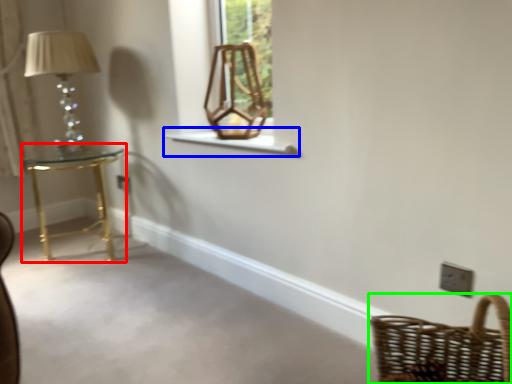
Question: Based on their relative distances, which object is nearer to table (highlighted by a red box)? Choose from window sill (highlighted by a blue box) and basket (highlighted by a green box).

Choices:
 (A) window sill
 (B) basket

Answer: (A)